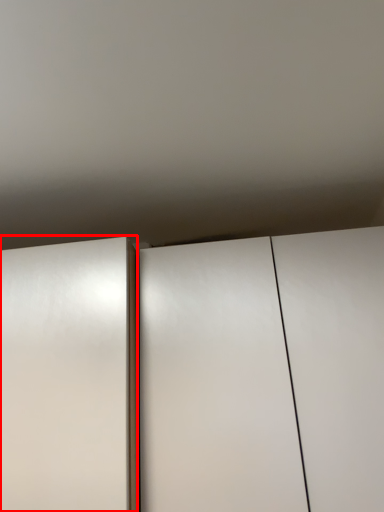
Question: From the image's perspective, what is the correct spatial positioning of door (annotated by the red box) in reference to cupboard?

Choices:
 (A) below
 (B) above

Answer: (A)